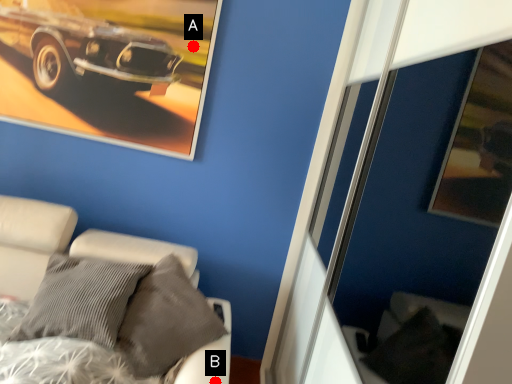
Question: Two points are circled on the image, labeled by A and B beside each circle. Which point is closer to the camera?

Choices:
 (A) A is closer
 (B) B is closer

Answer: (B)